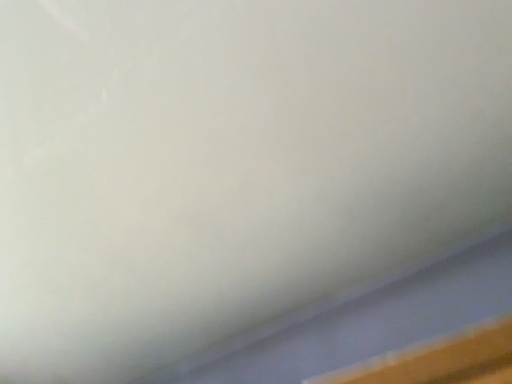
Question: Should I look upward or downward to see brown matte plywood at lower right?

Choices:
 (A) up
 (B) down

Answer: (B)